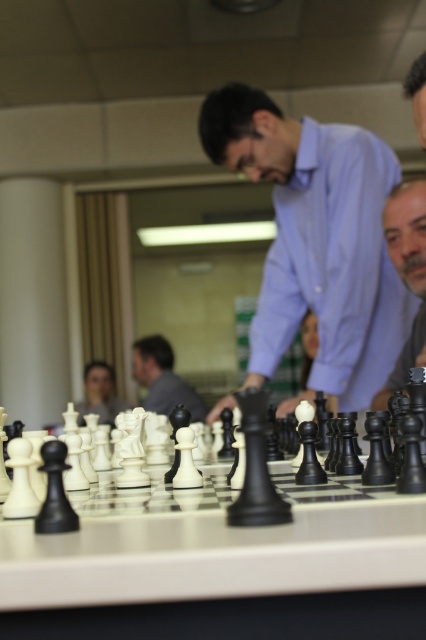
You are a photographer standing at the entrance of the room. You notice a point at coordinates point (316, 243). What object is this point located on?

The point (316, 243) is located on the matte blue shirt at center.

You are a photographer taking a picture of the chessboard. You want to focus on both the point at point [273,134] and point [385,397]. Given that your camera can only focus on one plane at a time, which point should you focus on to ensure the other is also in focus?

You should focus on point [385,397] because it is closer to the viewer than point [273,134]. By focusing on the closer point, the farther point will also be within the depth of field.

You are a chess player trying to move your pieces. You have a smooth black chess piece at right and a matte black chess piece at center. Which of these two pieces is positioned higher on the chessboard?

The smooth black chess piece at right is positioned higher on the chessboard than the matte black chess piece at center because it is above it.